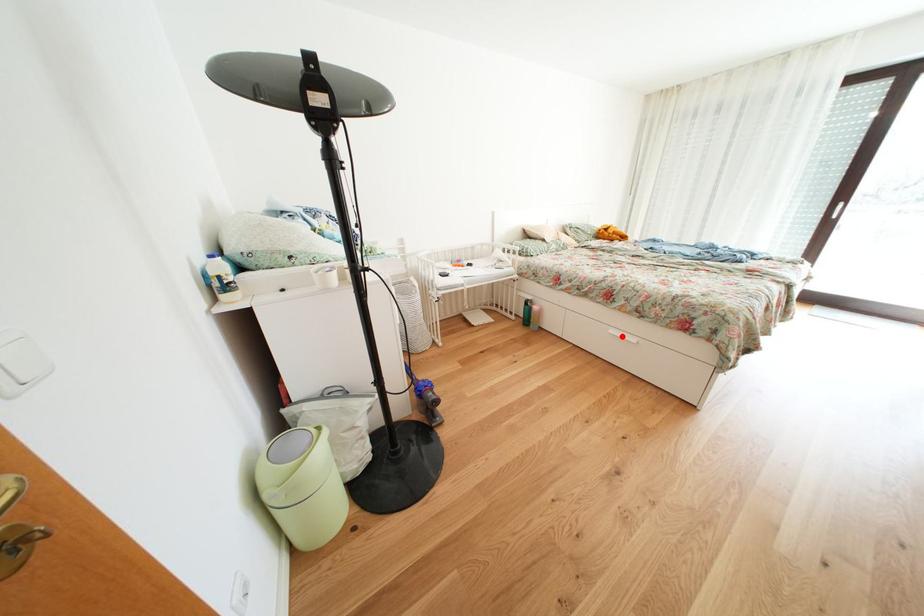
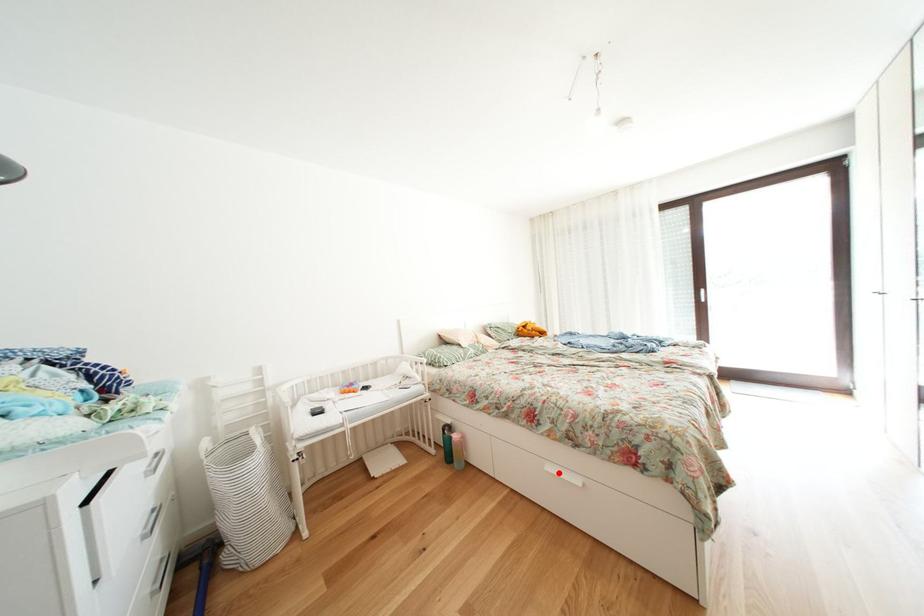
I am providing you with two images of the same scene from different viewpoints. A red point is marked on the first image and another point is marked on the second image. Is the red point in image1 aligned with the point shown in image2?

Yes